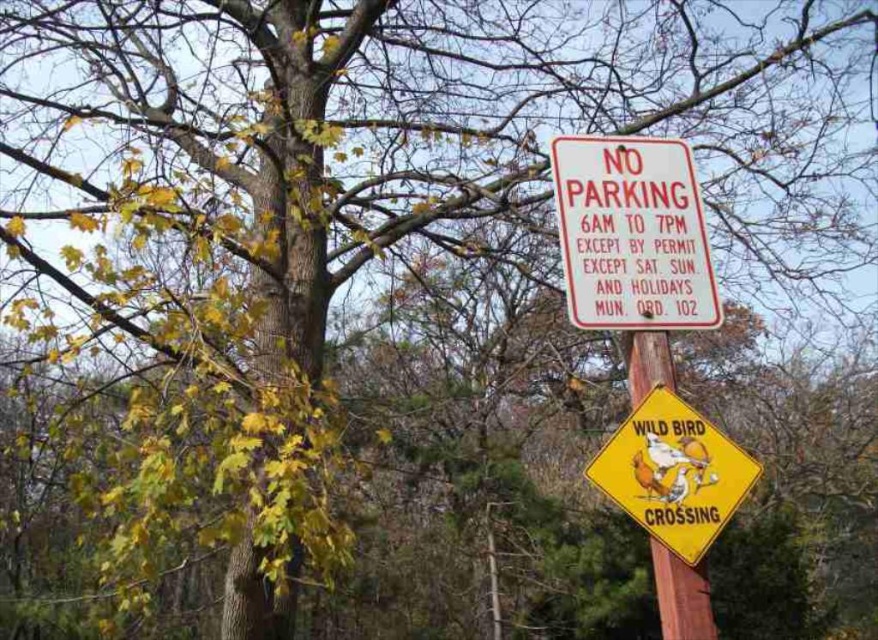
Based on the photo, can you confirm if yellow diamond-shaped sign at center-right is smaller than wooden post at center?

Actually, yellow diamond-shaped sign at center-right might be larger than wooden post at center.

Where is `yellow diamond-shaped sign at center-right`? The width and height of the screenshot is (878, 640). yellow diamond-shaped sign at center-right is located at coordinates (673, 474).

I want to click on yellow diamond-shaped sign at center-right, so click(673, 474).

Which is above, white paper sign at upper center or wooden post at center?

white paper sign at upper center is higher up.

Can you confirm if white paper sign at upper center is taller than wooden post at center?

Correct, white paper sign at upper center is much taller as wooden post at center.

Identify the location of white paper sign at upper center. The height and width of the screenshot is (640, 878). click(631, 234).

Locate an element on the screen. This screenshot has height=640, width=878. white paper sign at upper center is located at coordinates (631, 234).

Which is more to the left, white paper sign at upper center or yellow diamond-shaped sign at center-right?

white paper sign at upper center

Is point (627, 188) farther from viewer compared to point (634, 476)?

That is True.

Where is `white paper sign at upper center`? This screenshot has height=640, width=878. white paper sign at upper center is located at coordinates (631, 234).